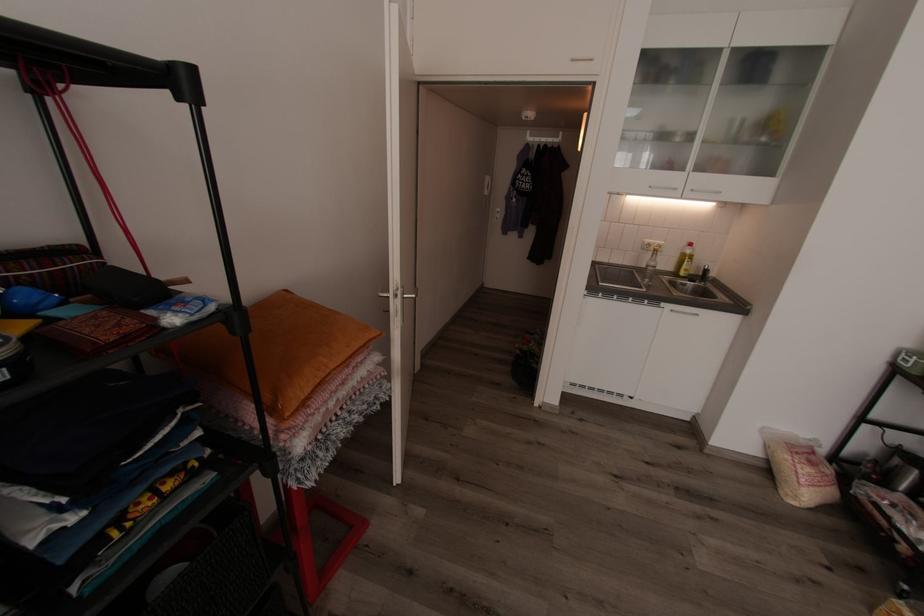
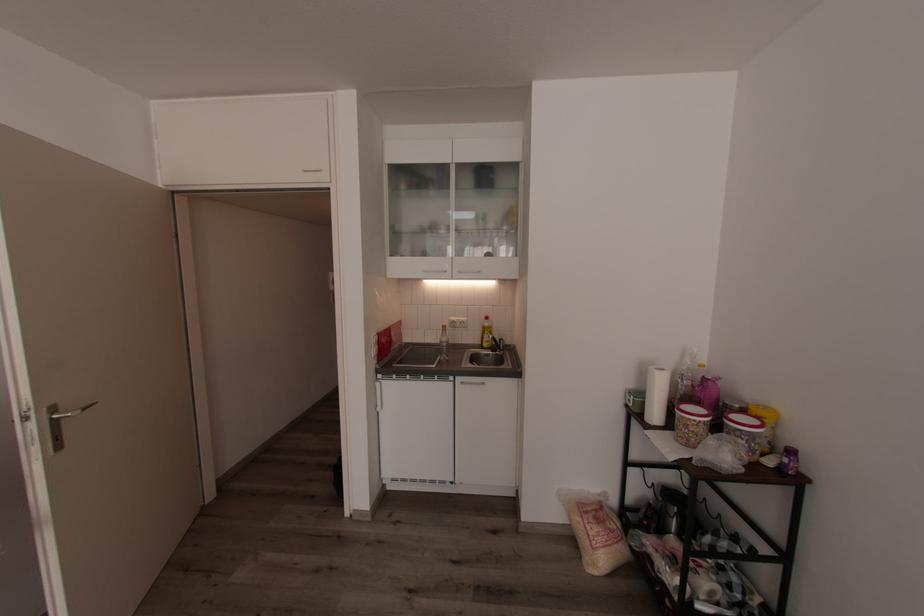
The point at (667, 304) is marked in the first image. Where is the corresponding point in the second image?

(456, 378)